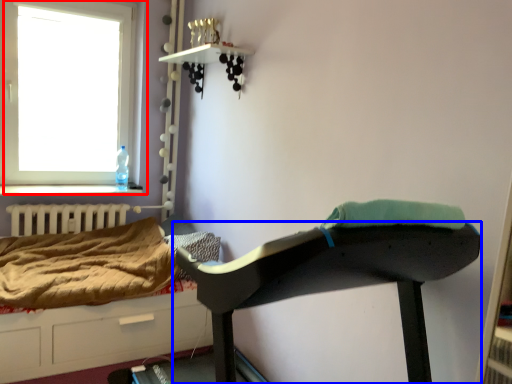
Question: Which of the following is the closest to the observer, window (highlighted by a red box) or furniture (highlighted by a blue box)?

Choices:
 (A) window
 (B) furniture

Answer: (B)